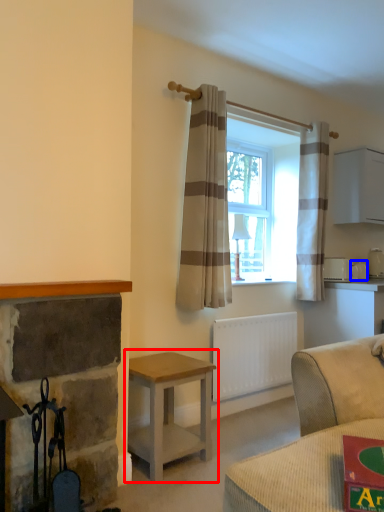
Question: Which of the following is the closest to the observer, table (highlighted by a red box) or appliance (highlighted by a blue box)?

Choices:
 (A) table
 (B) appliance

Answer: (A)